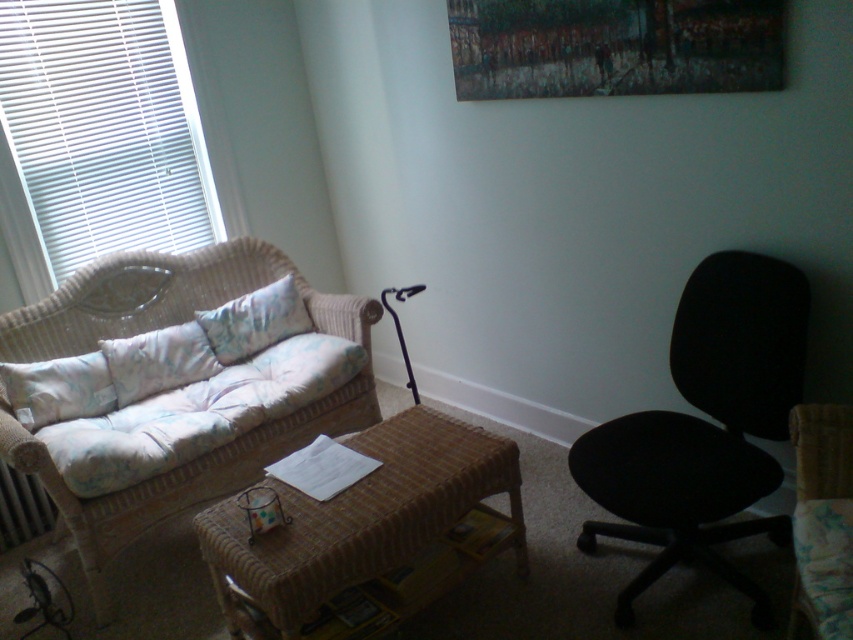
You are standing at the center of the room and want to move to the point marked at coordinates (822, 518). Which direction should you move to reach it?

The point at coordinates (822, 518) is located on the black fabric swivel chair at right, so you should move towards the right side of the room to reach it.

You are standing in the room and want to pick up an object. There are two points marked in the scene, point A at coordinates point (798, 541) and point B at coordinates point (256, 316). Which point is closer to you?

Point A at coordinates point (798, 541) is closer to you than point B at coordinates point (256, 316).

You are arranging a cozy reading nook and want to place both the fluffy white pillow at left and the fluffy pastel pillow at left on the loveseat. Which pillow should you place on top to ensure stability?

The fluffy pastel pillow at left is taller than the fluffy white pillow at left, so placing the taller one on top would provide better stability.